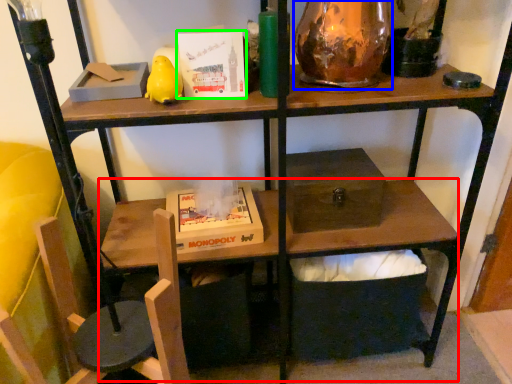
Question: Which object is positioned farthest from computer desk (highlighted by a red box)? Select from glass vase (highlighted by a blue box) and paperback book (highlighted by a green box).

Choices:
 (A) glass vase
 (B) paperback book

Answer: (B)